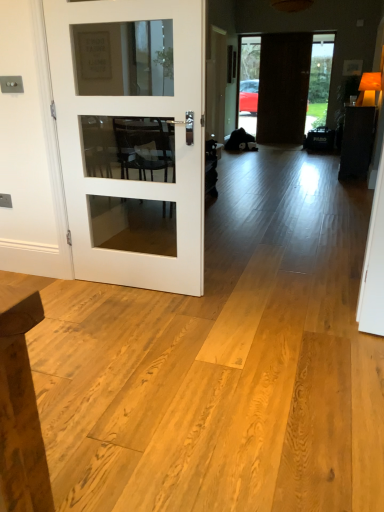
Question: Does dark brown wooden door at center, the first door when ordered from top to bottom, lie in front of white glass door at left, which appears as the 2th door when viewed from the back?

Choices:
 (A) yes
 (B) no

Answer: (B)

Question: Is dark brown wooden door at center, which ranks as the 2th door in bottom-to-top order, thinner than white glass door at left, the second door from the top?

Choices:
 (A) no
 (B) yes

Answer: (B)

Question: From the image's perspective, is dark brown wooden door at center, arranged as the 2th door when viewed from the front, located beneath white glass door at left, the second door from the top?

Choices:
 (A) no
 (B) yes

Answer: (A)

Question: Is dark brown wooden door at center, which is the first door from back to front, shorter than white glass door at left, the second door from the top?

Choices:
 (A) yes
 (B) no

Answer: (B)

Question: Is dark brown wooden door at center, which is the first door from back to front, with white glass door at left, which appears as the second door when viewed from the right?

Choices:
 (A) no
 (B) yes

Answer: (A)

Question: Does dark brown wooden door at center, which is counted as the first door, starting from the right, appear on the left side of white glass door at left, which ranks as the first door in left-to-right order?

Choices:
 (A) yes
 (B) no

Answer: (B)

Question: Could you tell me if white glass door at left, the second door from the top, is turned towards dark brown wooden door at center, the second door when ordered from left to right?

Choices:
 (A) yes
 (B) no

Answer: (B)

Question: Can you confirm if white glass door at left, the second door from the top, is taller than dark brown wooden door at center, which is counted as the first door, starting from the right?

Choices:
 (A) no
 (B) yes

Answer: (A)

Question: Is dark brown wooden door at center, which ranks as the 2th door in bottom-to-top order, completely or partially inside white glass door at left, which ranks as the first door in bottom-to-top order?

Choices:
 (A) no
 (B) yes

Answer: (A)

Question: From a real-world perspective, is white glass door at left, which appears as the 2th door when viewed from the back, below dark brown wooden door at center, which is counted as the first door, starting from the right?

Choices:
 (A) yes
 (B) no

Answer: (A)

Question: From the image's perspective, is white glass door at left, which appears as the second door when viewed from the right, located beneath dark brown wooden door at center, which is counted as the first door, starting from the right?

Choices:
 (A) no
 (B) yes

Answer: (B)

Question: Is white glass door at left, which appears as the 2th door when viewed from the back, thinner than dark brown wooden door at center, the first door when ordered from top to bottom?

Choices:
 (A) no
 (B) yes

Answer: (A)

Question: Is dark brown wooden door at center, the second door when ordered from left to right, wider or thinner than white glass door at left, which appears as the second door when viewed from the right?

Choices:
 (A) wide
 (B) thin

Answer: (B)